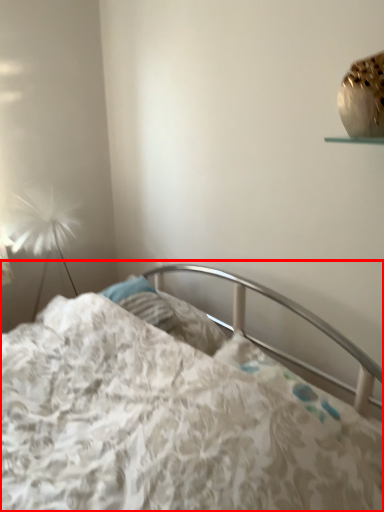
Question: Where is bed (annotated by the red box) located in relation to lamp in the image?

Choices:
 (A) right
 (B) left

Answer: (A)